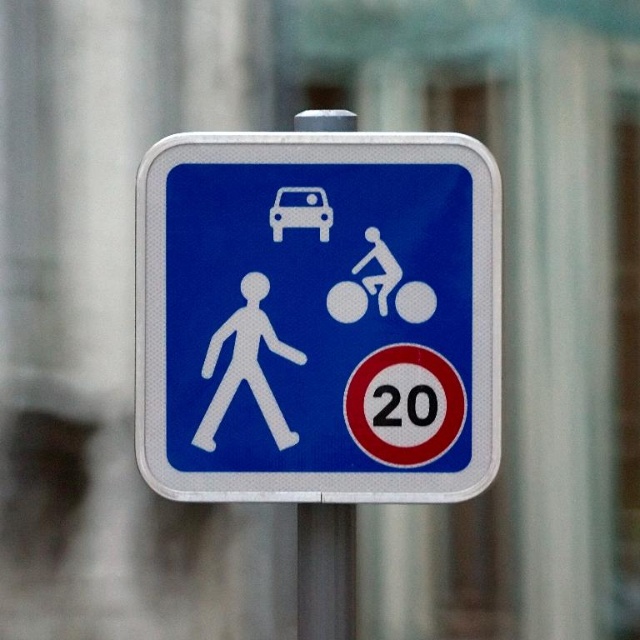
Looking at this image, is silver metallic pole at center shorter than white plastic car at upper center?

No.

Measure the distance between point (349, 125) and camera.

The distance of point (349, 125) from camera is 5.39 feet.

Where is `silver metallic pole at center`? silver metallic pole at center is located at coordinates (324, 572).

Measure the distance between white matte pedestrian at center and white plastic car at upper center.

They are 3.83 inches apart.

Describe the element at coordinates (244, 365) in the screenshot. The image size is (640, 640). I see `white matte pedestrian at center` at that location.

I want to click on white matte pedestrian at center, so click(244, 365).

This screenshot has width=640, height=640. What do you see at coordinates (316, 320) in the screenshot? I see `blue metallic sign at center` at bounding box center [316, 320].

Is point (346, 180) farther from camera compared to point (294, 221)?

Yes.

The image size is (640, 640). Identify the location of blue metallic sign at center. (316, 320).